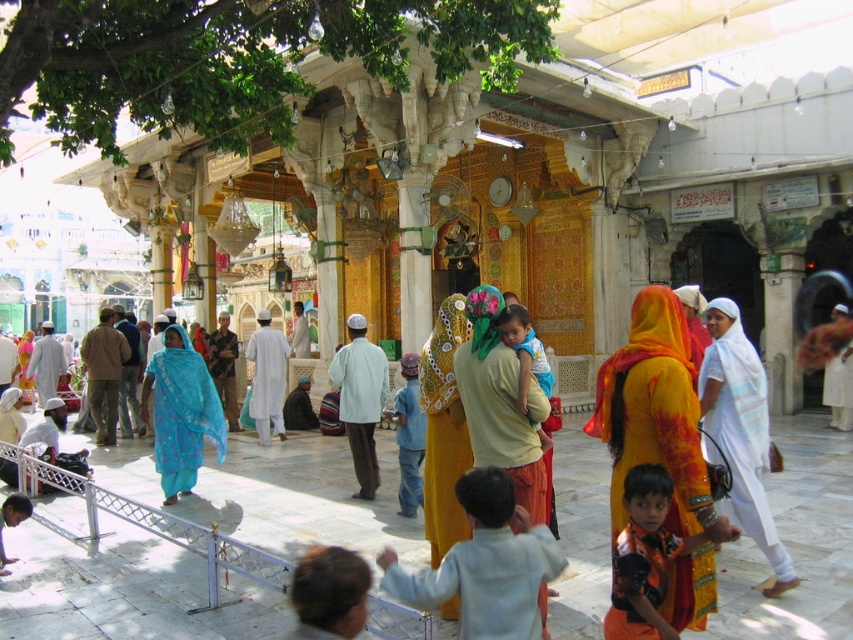
Question: Which point appears closest to the camera in this image?

Choices:
 (A) (360, 477)
 (B) (631, 596)

Answer: (B)

Question: Among these objects, which one is farthest from the camera?

Choices:
 (A) blue printed fabric at center
 (B) light blue cotton robe at lower center
 (C) matte blue robe at center

Answer: (C)

Question: Among these objects, which one is farthest from the camera?

Choices:
 (A) orange cotton shirt at center
 (B) light blue fabric at lower left
 (C) white matte shirt at center
 (D) brown fuzzy head at lower center

Answer: (C)

Question: Does white matte shirt at center have a larger size compared to white cotton robe at center?

Choices:
 (A) no
 (B) yes

Answer: (A)

Question: Is orange printed sari at center thinner than orange cotton shirt at center?

Choices:
 (A) yes
 (B) no

Answer: (B)

Question: Is orange printed sari at center below brown fuzzy head at lower center?

Choices:
 (A) no
 (B) yes

Answer: (A)